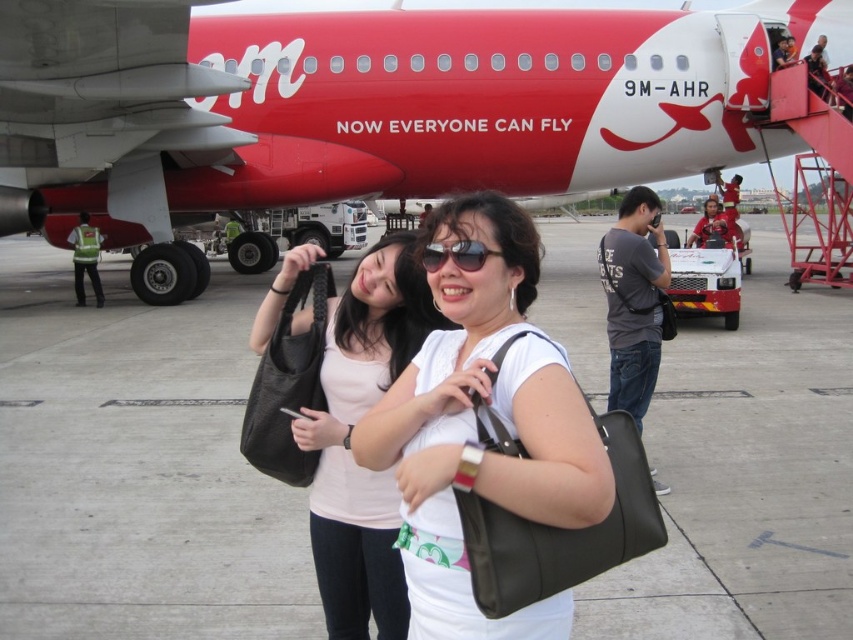
Question: Which of the following is the farthest from the observer?

Choices:
 (A) (598, 490)
 (B) (241, 124)
 (C) (210, 440)

Answer: (B)

Question: Considering the relative positions of white matte shirt at center and matte black bag at center in the image provided, where is white matte shirt at center located with respect to matte black bag at center?

Choices:
 (A) above
 (B) below

Answer: (A)

Question: Is matte gray tarmac at center to the left of matte black bag at center from the viewer's perspective?

Choices:
 (A) no
 (B) yes

Answer: (B)

Question: Which point is closer to the camera taking this photo?

Choices:
 (A) (654, 369)
 (B) (355, 480)
 (C) (728, 384)

Answer: (B)

Question: Is red matte airplane at center to the left of matte black bag at center from the viewer's perspective?

Choices:
 (A) yes
 (B) no

Answer: (B)

Question: Based on their relative distances, which object is farther from the sunglasses at center?

Choices:
 (A) matte gray tarmac at center
 (B) gray fabric camera bag at right

Answer: (A)